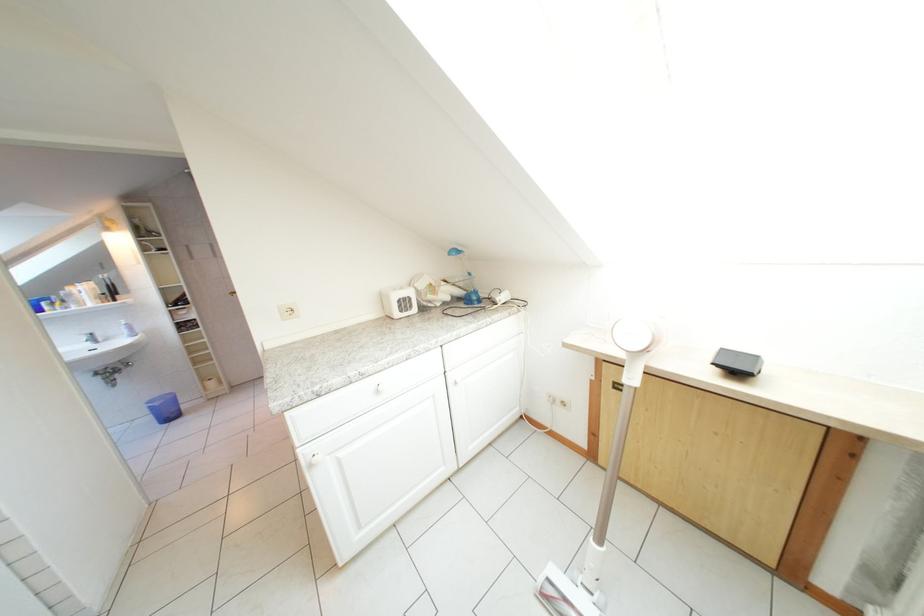
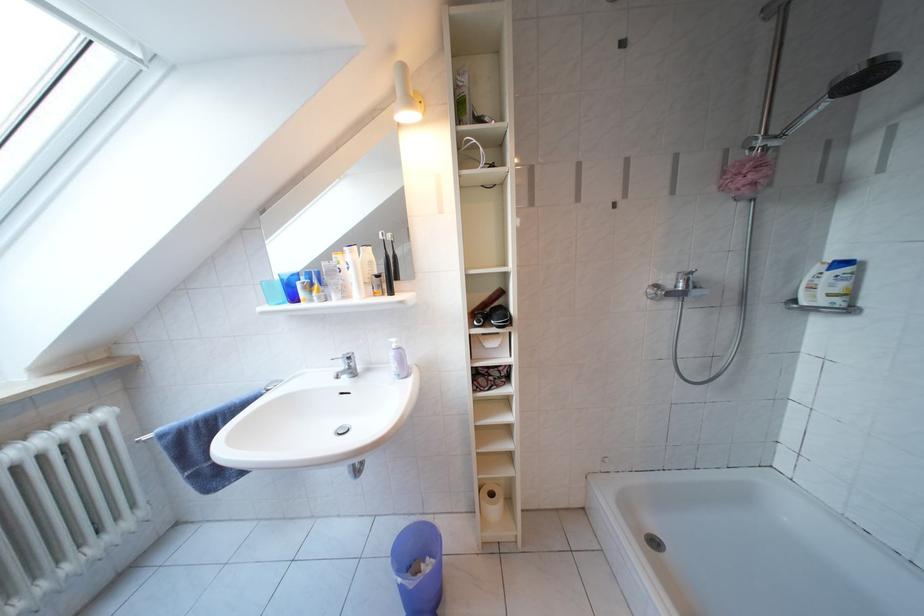
In the second image, find the point that corresponds to point 166,408 in the first image.

(419, 589)